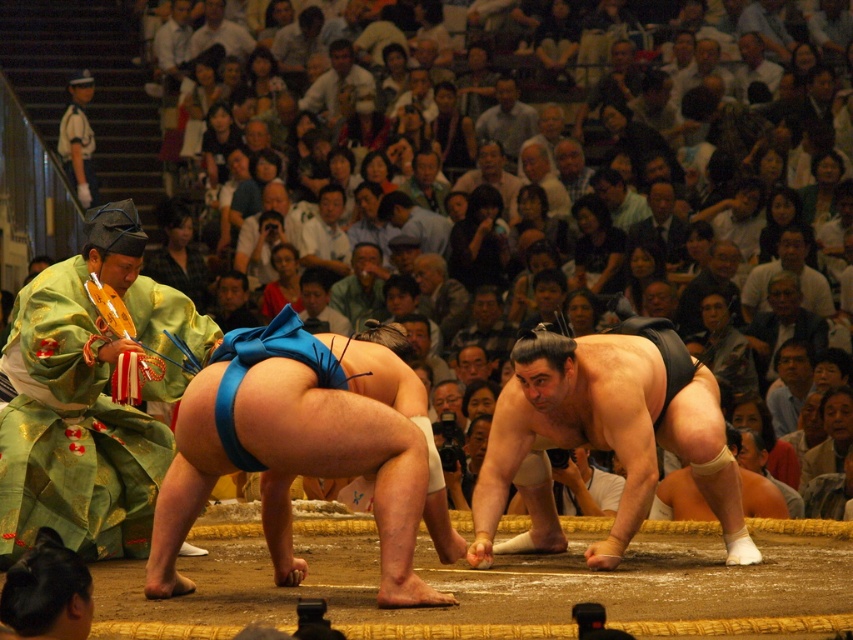
You are a photographer standing at the edge of the sumo wrestling arena. You want to capture a close shot of the black matte sumo wrestler at center. Given that your camera has a minimum focusing distance of 10 meters, will you be able to take the photo without moving closer?

The black matte sumo wrestler at center and camera are 14.08 meters apart from each other. Since the minimum focusing distance is 10 meters, the photographer can take the photo without moving closer because the distance is within the camera capabilities.

Looking at this image, you are a photographer standing at the center of the arena. You want to take a photo of the green silk kimono at left. Given that your camera can only focus on objects within a 0.5 unit radius from your current position, will the point at coordinates point [91,394] be within your camera focus range?

The point [91,394] is on green silk kimono at left. The distance between the photographer at the center of the arena and the point [91,394] would need to be calculated. Since the arena is large and the coordinates are given in normalized units, the point is likely within the 0.5 unit radius. Therefore, the camera can focus on the green silk kimono at left.

You are a photographer standing outside the arena. You want to take a photo of the black matte sumo wrestler at center and the white uniform at upper left. Which one will appear larger in the photo?

The black matte sumo wrestler at center will appear larger in the photo because it is closer to the camera than the white uniform at upper left.